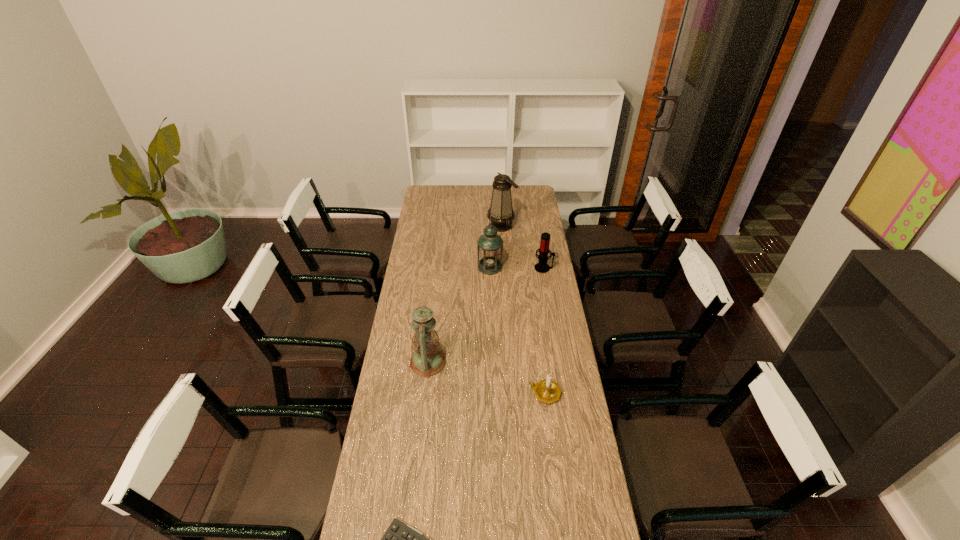
The height and width of the screenshot is (540, 960). Identify the location of free spot that satisfies the following two spatial constraints: 1. on the front side of the second farthest oil lamp; 2. on the right side of the candle holder. (493, 393).